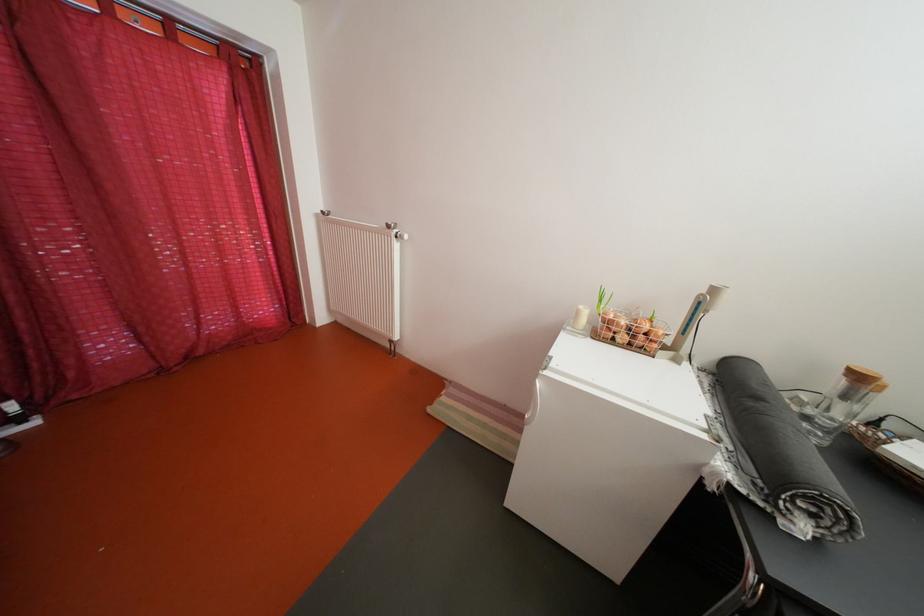
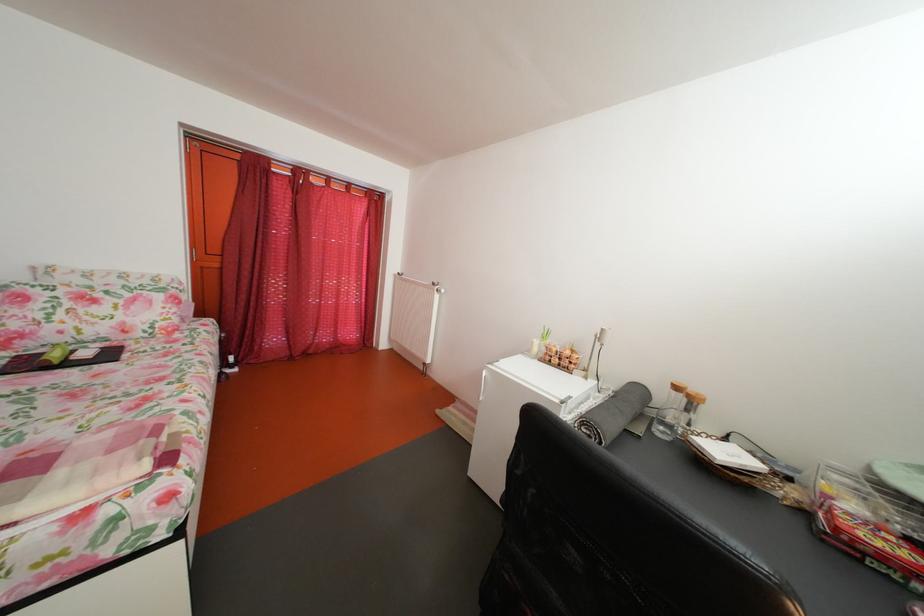
Question: The camera is either moving clockwise (left) or counter-clockwise (right) around the object. The first image is from the beginning of the video and the second image is from the end. Is the camera moving left or right when shooting the video?

Choices:
 (A) Left
 (B) Right

Answer: (B)